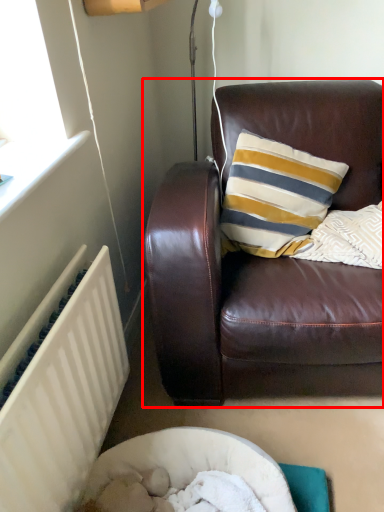
Question: Observing the image, what is the correct spatial positioning of studio couch (annotated by the red box) in reference to radiator?

Choices:
 (A) right
 (B) left

Answer: (A)